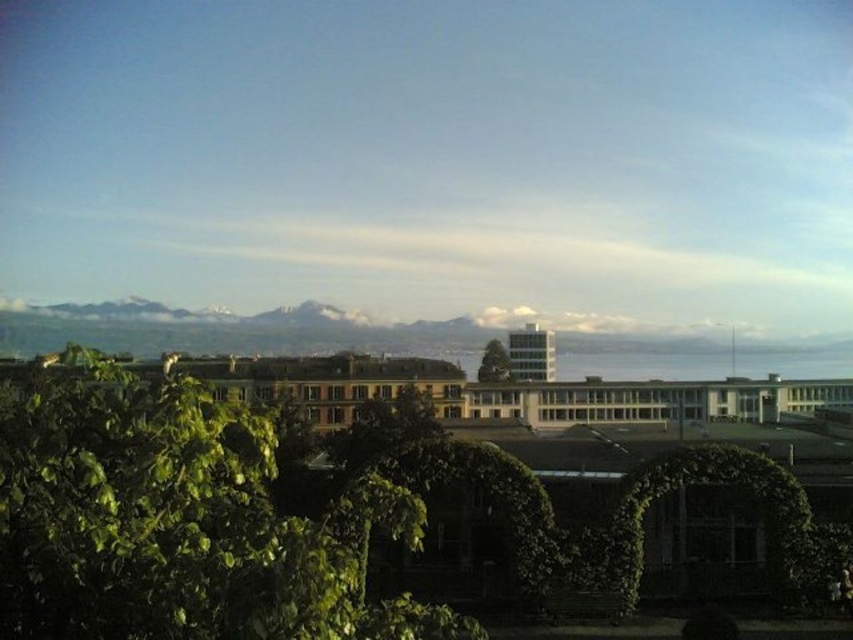
Looking at this image, you are standing in the garden and want to walk towards both the green leafy tree at lower left and the green leafy tree at center. Which tree should you approach first to reach the one closer to you?

You should approach the green leafy tree at lower left first because it is closer to you than the green leafy tree at center.

You are standing at the center of the image and want to find the green leafy tree at lower left. In which direction should you look to locate it?

The green leafy tree at lower left is located at point coordinates that are to the left and downward from the center, so you should look to the lower left direction to find it.

You are a landscape architect designing a pathway between the green leafy tree at lower left and the green leafy tree at center. Considering their sizes, which tree should the pathway be closer to?

The pathway should be closer to the green leafy tree at center since it is smaller than the green leafy tree at lower left, allowing for better space utilization.